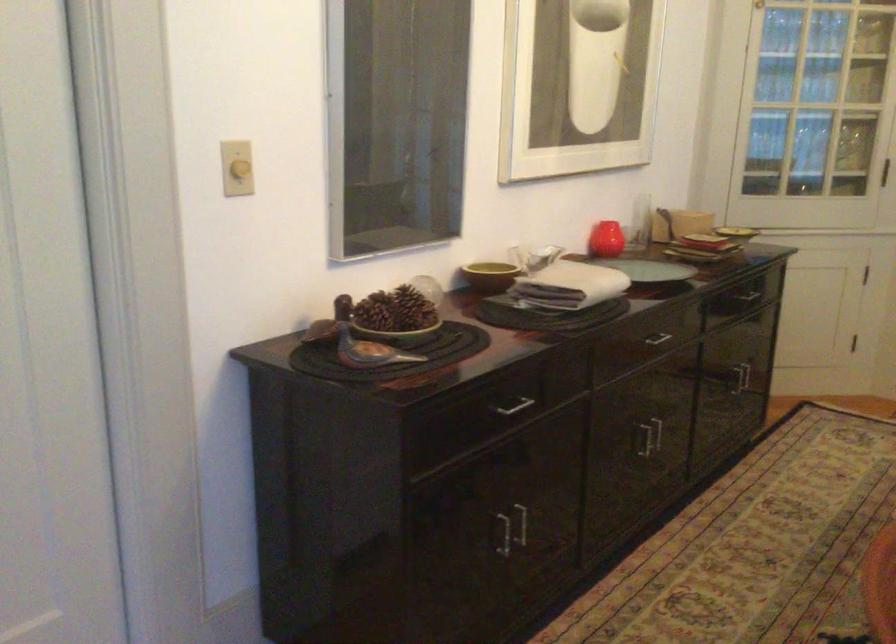
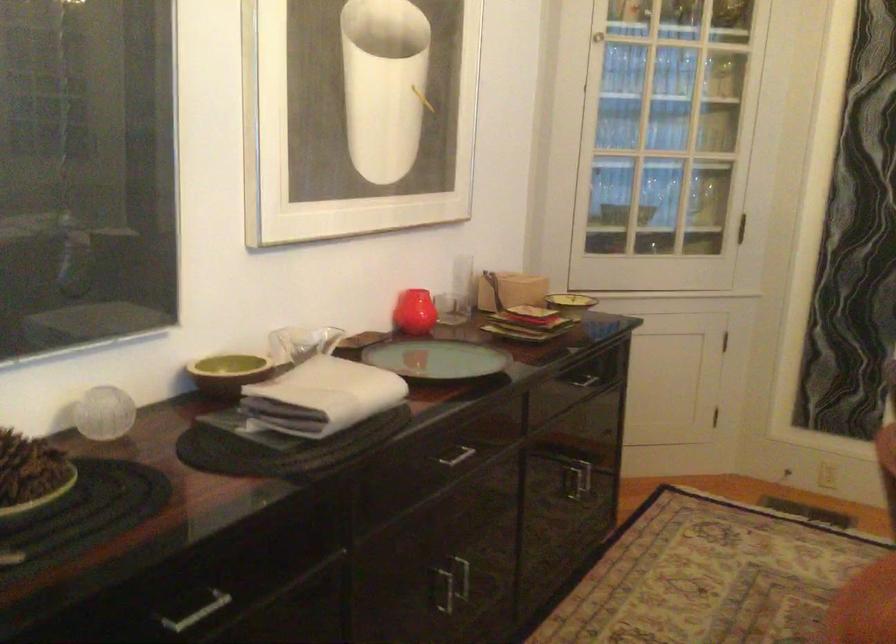
Where in the second image is the point corresponding to the point at 493,270 from the first image?

(228, 373)